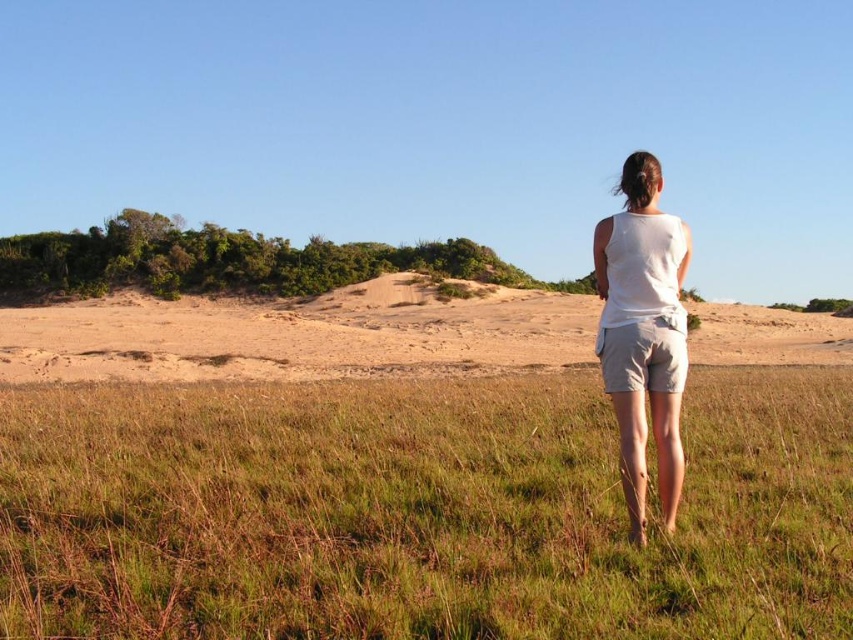
Question: Which of these objects is positioned farthest from the brown dry grass at center?

Choices:
 (A) white cotton shorts at center
 (B) white cotton tank top at center

Answer: (A)

Question: Is brown dry grass at center bigger than white cotton tank top at center?

Choices:
 (A) yes
 (B) no

Answer: (B)

Question: Which object is closer to the camera taking this photo?

Choices:
 (A) white cotton shorts at center
 (B) white cotton tank top at center

Answer: (B)

Question: Where is white cotton tank top at center located in relation to white cotton shorts at center in the image?

Choices:
 (A) above
 (B) below

Answer: (A)

Question: Which object is the farthest from the white cotton tank top at center?

Choices:
 (A) white cotton shorts at center
 (B) brown dry grass at center

Answer: (B)

Question: Does brown dry grass at center lie in front of white cotton shorts at center?

Choices:
 (A) no
 (B) yes

Answer: (B)